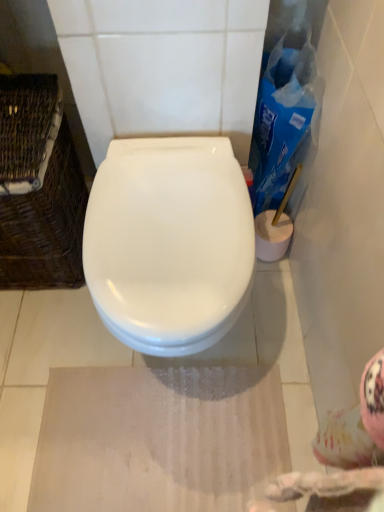
What is the approximate height of blue plastic cleaning product at right?

It is 50.19 centimeters.

The image size is (384, 512). I want to click on blue plastic cleaning product at right, so click(x=285, y=122).

From a real-world perspective, does white glossy toilet at center stand above blue plastic cleaning product at right?

No, from a real-world perspective, white glossy toilet at center is not above blue plastic cleaning product at right.

Based on their sizes in the image, would you say white glossy toilet at center is bigger or smaller than blue plastic cleaning product at right?

Clearly, white glossy toilet at center is larger in size than blue plastic cleaning product at right.

Does point (167, 348) come closer to viewer compared to point (279, 113)?

Yes, point (167, 348) is closer to viewer.

Could blue plastic cleaning product at right be considered to be inside white glossy toilet at center?

No.

Considering the sizes of objects woven brown basket at left and blue plastic cleaning product at right in the image provided, who is smaller, woven brown basket at left or blue plastic cleaning product at right?

blue plastic cleaning product at right is smaller.

Is point (80, 212) less distant than point (310, 59)?

That is False.

From a real-world perspective, is woven brown basket at left physically above blue plastic cleaning product at right?

No, from a real-world perspective, woven brown basket at left is not on top of blue plastic cleaning product at right.

Is woven brown basket at left far away from blue plastic cleaning product at right?

No, woven brown basket at left is in close proximity to blue plastic cleaning product at right.

Is blue plastic cleaning product at right placed right next to white glossy toilet at center?

No, blue plastic cleaning product at right is not touching white glossy toilet at center.

Which of these two, blue plastic cleaning product at right or white glossy toilet at center, is wider?

Wider between the two is white glossy toilet at center.

From a real-world perspective, is blue plastic cleaning product at right physically located above or below white glossy toilet at center?

Clearly, from a real-world perspective, blue plastic cleaning product at right is above white glossy toilet at center.

At what (x,y) coordinates should I click in order to perform the action: click on basket on the left side of white glossy toilet at center. Please return your answer as a coordinate pair (x, y). The width and height of the screenshot is (384, 512). Looking at the image, I should click on (46, 225).

Is woven brown basket at left surrounding white glossy toilet at center?

Definitely not — white glossy toilet at center is not inside woven brown basket at left.

Is woven brown basket at left facing away from white glossy toilet at center?

No.

In the image, is woven brown basket at left positioned in front of or behind white glossy toilet at center?

Visually, woven brown basket at left is located behind white glossy toilet at center.

Which is behind, point (126, 331) or point (59, 183)?

Positioned behind is point (59, 183).

Can you confirm if white glossy toilet at center is thinner than woven brown basket at left?

No.

Looking at this image, from the image's perspective, is white glossy toilet at center positioned above or below woven brown basket at left?

white glossy toilet at center is situated lower than woven brown basket at left in the image.

Find the location of a particular element. toilet that is on the right side of woven brown basket at left is located at coordinates (169, 242).

From a real-world perspective, which object rests below the other?

From a 3D spatial view, woven brown basket at left is below.

This screenshot has width=384, height=512. I want to click on cleaning product above the woven brown basket at left (from the image's perspective), so click(285, 122).

Measure the distance from blue plastic cleaning product at right to woven brown basket at left.

blue plastic cleaning product at right is 22.15 inches from woven brown basket at left.

Considering their positions, is blue plastic cleaning product at right located in front of or behind woven brown basket at left?

Clearly, blue plastic cleaning product at right is behind woven brown basket at left.

At what (x,y) coordinates should I click in order to perform the action: click on cleaning product above the white glossy toilet at center (from a real-world perspective). Please return your answer as a coordinate pair (x, y). The image size is (384, 512). Looking at the image, I should click on (285, 122).

What are the coordinates of `cleaning product lying behind the woven brown basket at left` in the screenshot? It's located at (285, 122).

Looking at the image, which one is located further to white glossy toilet at center, woven brown basket at left or blue plastic cleaning product at right?

blue plastic cleaning product at right is further to white glossy toilet at center.

Estimate the real-world distances between objects in this image. Which object is further from white glossy toilet at center, blue plastic cleaning product at right or woven brown basket at left?

blue plastic cleaning product at right lies further to white glossy toilet at center than the other object.

Estimate the real-world distances between objects in this image. Which object is further from blue plastic cleaning product at right, woven brown basket at left or white glossy toilet at center?

woven brown basket at left lies further to blue plastic cleaning product at right than the other object.

Looking at the image, which one is located closer to blue plastic cleaning product at right, white glossy toilet at center or woven brown basket at left?

Based on the image, white glossy toilet at center appears to be nearer to blue plastic cleaning product at right.

Looking at the image, which one is located closer to woven brown basket at left, blue plastic cleaning product at right or white glossy toilet at center?

white glossy toilet at center is positioned closer to the anchor woven brown basket at left.

From the image, which object appears to be nearer to woven brown basket at left, white glossy toilet at center or blue plastic cleaning product at right?

white glossy toilet at center lies closer to woven brown basket at left than the other object.

Find the location of a particular element. toilet between woven brown basket at left and blue plastic cleaning product at right in the horizontal direction is located at coordinates (169, 242).